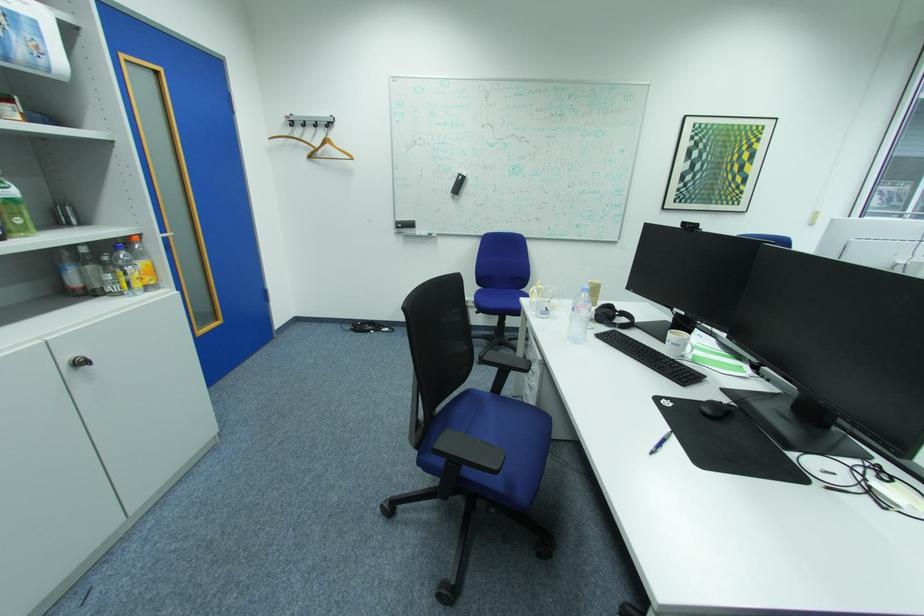
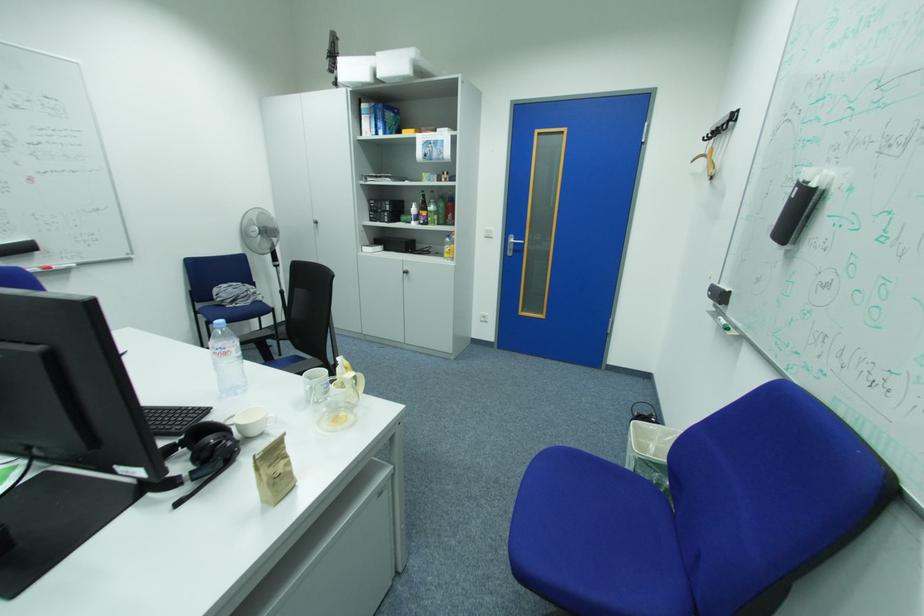
In the second image, find the point that corresponds to (x=91, y=363) in the first image.

(415, 273)